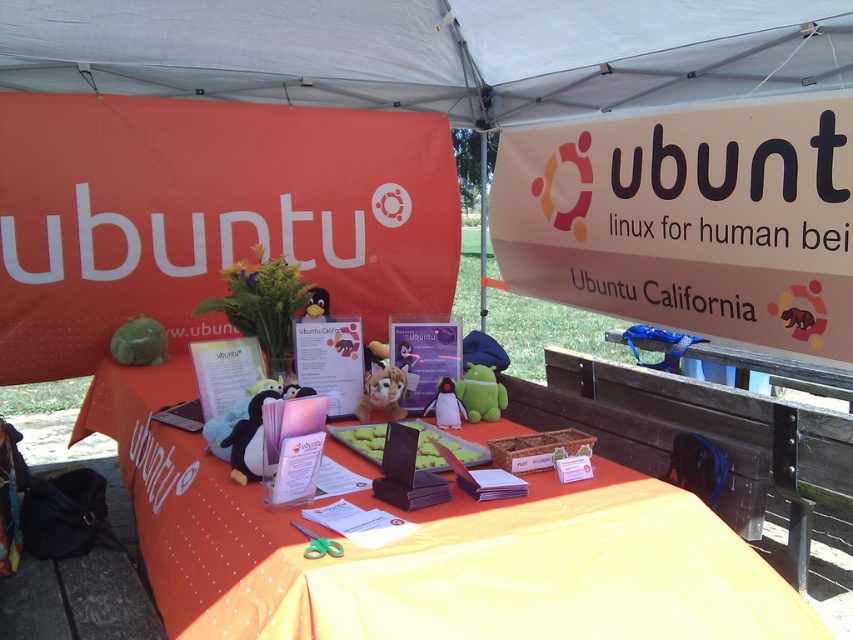
You are at an outdoor event under a white fabric canopy at upper center and see a fuzzy fabric stuffed animal at center. Can you tell me which object is wider?

The white fabric canopy at upper center is wider than the fuzzy fabric stuffed animal at center because the white fabric canopy at upper center has a greater width.

You are organizing a community event and need to place a new item on the orange fabric table at center. Considering the size of the green plush toy at center already there, will the table have enough space for the new item?

The orange fabric table at center is bigger than the green plush toy at center, so there should be enough space for the new item as long as it isn not larger than the table itself.

You are standing at the Ubuntu table and want to pick up both items located at point (520,72) and point (366,376). Which item should you reach for first to minimize the distance traveled?

You should reach for the item at point (520,72) first because it is closer to you than the item at point (366,376), as it is further away.